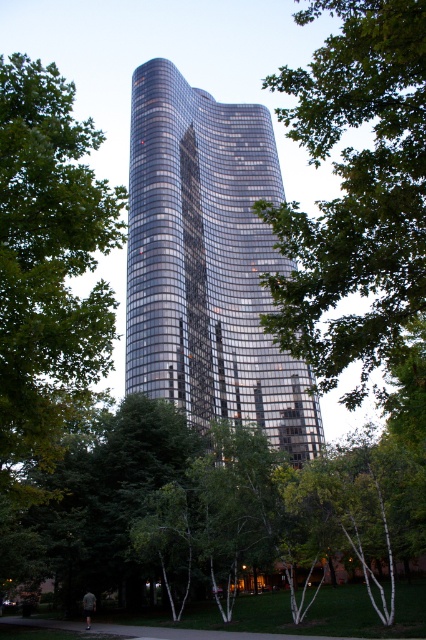
Question: Can you confirm if glossy glass tower at center is thinner than green leafy tree at left?

Choices:
 (A) no
 (B) yes

Answer: (A)

Question: Which is nearer to the green leafy tree at left?

Choices:
 (A) glossy glass tower at center
 (B) green leafy tree at center

Answer: (B)

Question: Which of the following is the farthest from the observer?

Choices:
 (A) green leafy tree at center
 (B) green leafy tree at left

Answer: (B)

Question: Is green leafy tree at center wider than green leafy tree at left?

Choices:
 (A) no
 (B) yes

Answer: (B)

Question: Which point is closer to the camera taking this photo?

Choices:
 (A) (416, 268)
 (B) (42, 346)

Answer: (A)

Question: Can you confirm if glossy glass tower at center is positioned below green leafy tree at left?

Choices:
 (A) no
 (B) yes

Answer: (A)